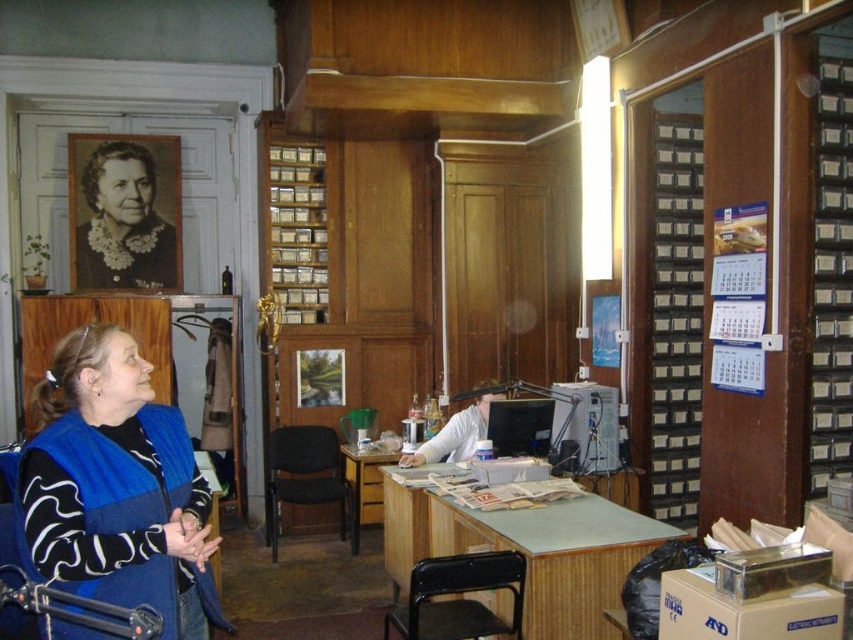
You are a visitor in this office and need to sit down. There is a black plastic chair at lower center and a matte black portrait at upper left. Which object is closer to you if you are standing at the entrance facing the room?

The black plastic chair at lower center is closer to you because it is behind the matte black portrait at upper left, meaning the chair is positioned further back in the room compared to the portrait.

Based on the photo, you are an interior designer planning to place a new painting that is 1.2 meters tall in this office. The matte black portrait at upper left and the black plastic chair at lower center are already present. Which object should you consider in terms of height when deciding where to place the new painting?

The matte black portrait at upper left is much taller than the black plastic chair at lower center, so you should consider the height of the matte black portrait at upper left when deciding where to place the new painting to ensure proper proportion and balance.

You are standing in the office and want to locate the matte black portrait at upper left. According to the coordinates provided, where should you look?

The matte black portrait at upper left is located at coordinates point (125, 212).